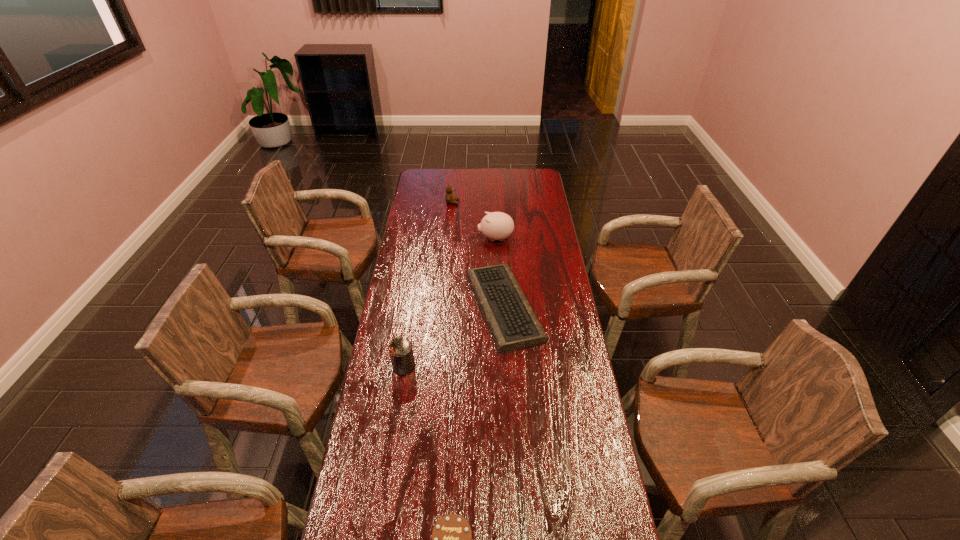
You are a GUI agent. You are given a task and a screenshot of the screen. Output one action in this format:
    pyautogui.click(x=<x>, y=<y>)
    Task: Click on the free space located on the back of the can
    The image size is (960, 540).
    Given the screenshot: What is the action you would take?
    pyautogui.click(x=407, y=346)

You are a GUI agent. You are given a task and a screenshot of the screen. Output one action in this format:
    pyautogui.click(x=<x>, y=<y>)
    Task: Click on the free space located at the face of the farthest object
    
    Given the screenshot: What is the action you would take?
    pyautogui.click(x=468, y=202)

You are a GUI agent. You are given a task and a screenshot of the screen. Output one action in this format:
    pyautogui.click(x=<x>, y=<y>)
    Task: Click on the vacant point located on the front of the third nearest object
    
    Given the screenshot: What is the action you would take?
    pyautogui.click(x=511, y=418)

This screenshot has width=960, height=540. I want to click on object present at the left edge, so click(x=401, y=352).

Identify the location of object situated at the right edge. The width and height of the screenshot is (960, 540). (512, 322).

Find the location of a particular element. Image resolution: width=960 pixels, height=540 pixels. vacant space at the far edge of the desktop is located at coordinates (484, 183).

In the image, there is a desktop. Where is `blank space at the left edge`? This screenshot has height=540, width=960. blank space at the left edge is located at coordinates 417,352.

Where is `blank space at the right edge of the desktop`? blank space at the right edge of the desktop is located at coordinates (560, 286).

The height and width of the screenshot is (540, 960). In the image, there is a desktop. What are the coordinates of `vacant space at the far left corner` in the screenshot? It's located at (414, 188).

Identify the location of free space at the far right corner. The height and width of the screenshot is (540, 960). (535, 172).